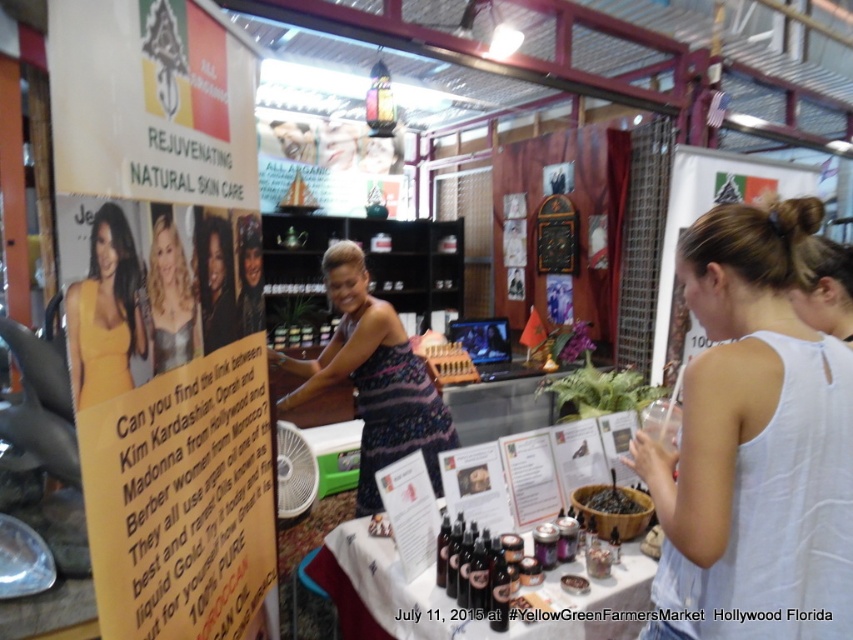
Question: Which of these objects is positioned farthest from the translucent glass bottles at center?

Choices:
 (A) shiny silver dress at center
 (B) matte black dress at center
 (C) dark brown wood bowl at center
 (D) yellow satin dress at left

Answer: (D)

Question: Estimate the real-world distances between objects in this image. Which object is farther from the shiny silver dress at center?

Choices:
 (A) matte black dress at center
 (B) translucent glass bottles at center

Answer: (B)

Question: Is shiny silver dress at center to the right of translucent glass bottles at center from the viewer's perspective?

Choices:
 (A) no
 (B) yes

Answer: (A)

Question: Is striped fabric dress at center to the right of yellow satin dress at left from the viewer's perspective?

Choices:
 (A) yes
 (B) no

Answer: (A)

Question: Does white cotton tank top at right appear over dark brown wood bowl at center?

Choices:
 (A) yes
 (B) no

Answer: (A)

Question: Based on their relative distances, which object is nearer to the translucent glass bottles at center?

Choices:
 (A) white cotton tank top at right
 (B) dark brown wood bowl at center
 (C) yellow satin dress at left
 (D) shiny silver dress at center

Answer: (B)